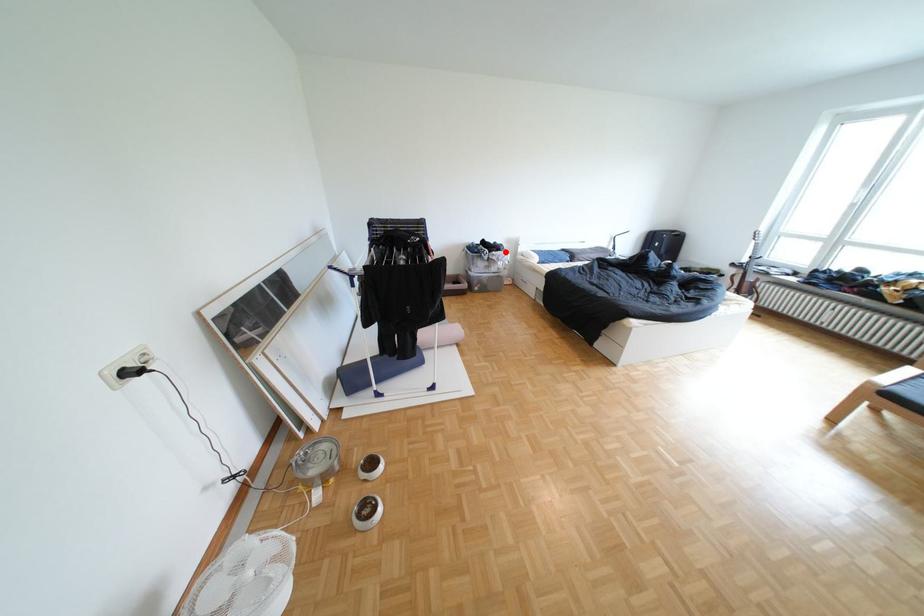
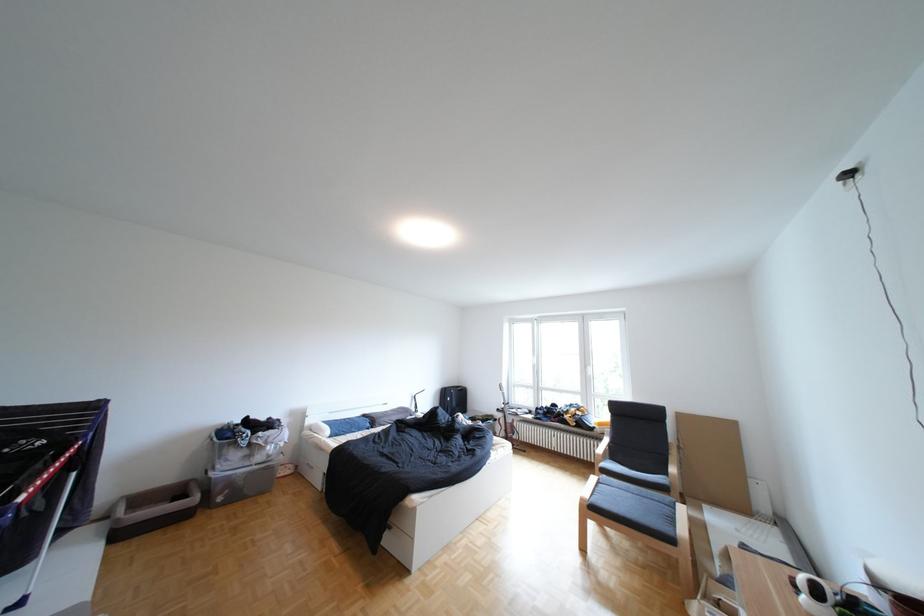
Question: I am providing you with two images of the same scene from different viewpoints. In image1, a red point is highlighted. Considering the same 3D point in image2, which of the following is correct?

Choices:
 (A) It is closer
 (B) It is farther

Answer: (B)